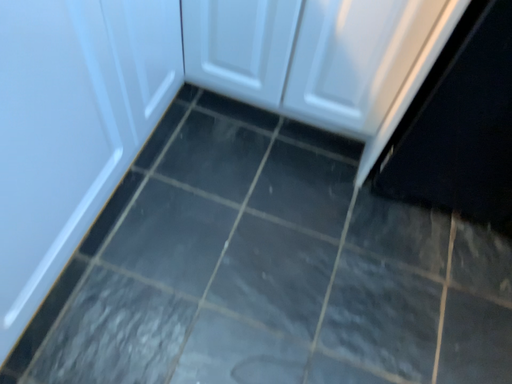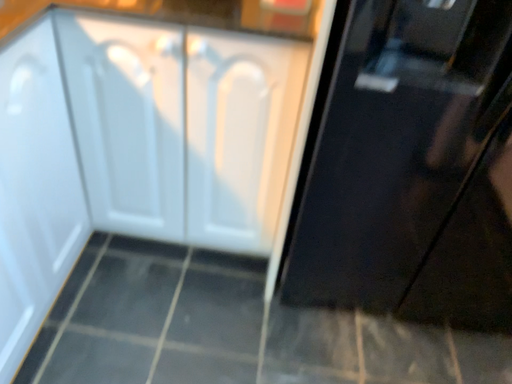
Question: How did the camera likely rotate when shooting the video?

Choices:
 (A) rotated upward
 (B) rotated downward

Answer: (A)